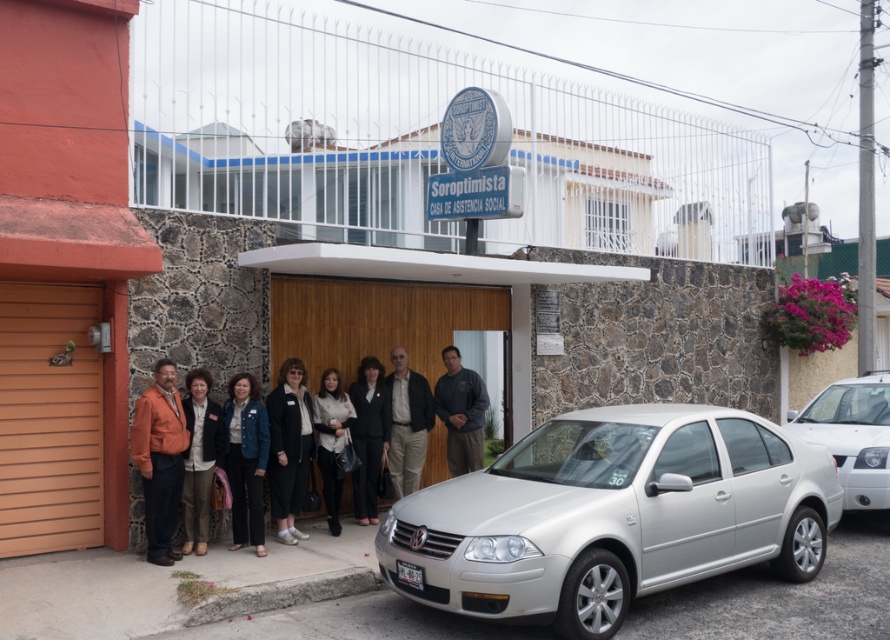
Question: Considering the relative positions of silver metallic sedan at center and black matte blazer at center in the image provided, where is silver metallic sedan at center located with respect to black matte blazer at center?

Choices:
 (A) left
 (B) right

Answer: (B)

Question: Does dark brown leather jacket at center have a smaller size compared to black leather jacket at center?

Choices:
 (A) no
 (B) yes

Answer: (A)

Question: Which of the following is the closest to the observer?

Choices:
 (A) orange fabric jacket at left
 (B) white metallic sedan at center

Answer: (B)

Question: Is denim jacket at center above light brown leather jacket at center?

Choices:
 (A) no
 (B) yes

Answer: (A)

Question: Which object is the farthest from the silver metallic sedan at center?

Choices:
 (A) light brown leather jacket at center
 (B) denim jacket at center

Answer: (A)

Question: Which point is closer to the camera taking this photo?

Choices:
 (A) (164, 397)
 (B) (201, 436)

Answer: (A)